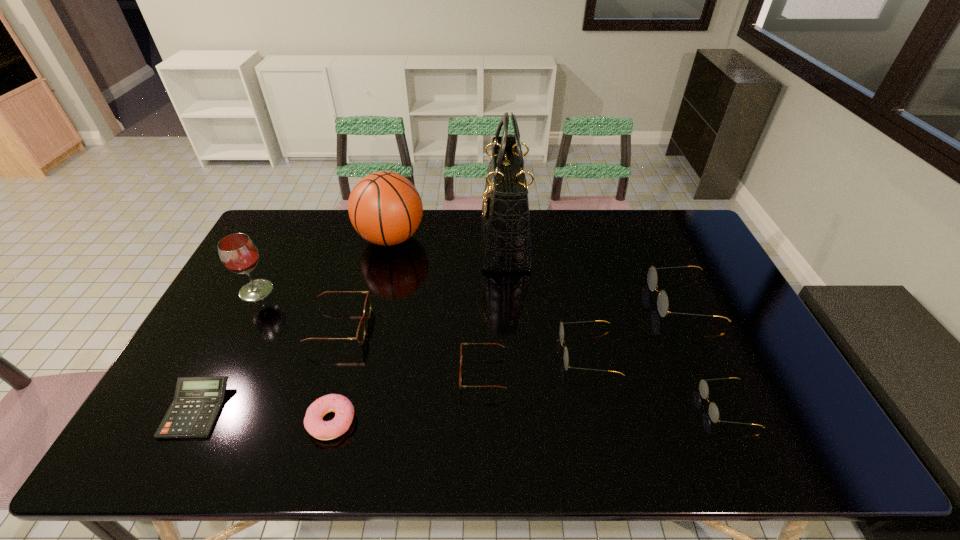
I want to click on object that is the fifth closest to the calculator, so click(x=461, y=365).

Select which spectacles is the fourth closest to the tallest object. Please provide its 2D coordinates. Your answer should be formatted as a tuple, i.e. [(x, y)], where the tuple contains the x and y coordinates of a point satisfying the conditions above.

[(360, 336)]

At what (x,y) coordinates should I click in order to perform the action: click on spectacles identified as the fourth closest to the smallest gold spectacles. Please return your answer as a coordinate pair (x, y). This screenshot has width=960, height=540. Looking at the image, I should click on (360, 336).

Identify which gold spectacles is the closest to the leftmost spectacles. Please provide its 2D coordinates. Your answer should be formatted as a tuple, i.e. [(x, y)], where the tuple contains the x and y coordinates of a point satisfying the conditions above.

[(561, 331)]

The image size is (960, 540). I want to click on gold spectacles that is the closest one to the tallest object, so click(x=561, y=331).

Locate an element on the screen. free space that satisfies the following two spatial constraints: 1. on the back side of the pink doughnut; 2. at the front view of the leftmost spectacles is located at coordinates (357, 327).

Identify the location of vacant region that satisfies the following two spatial constraints: 1. on the back side of the pink doughnut; 2. at the front view of the farther brown spectacles. The width and height of the screenshot is (960, 540). (357, 327).

The image size is (960, 540). What are the coordinates of `free space that satisfies the following two spatial constraints: 1. on the temples of the tallest spectacles; 2. on the front side of the calculator` in the screenshot? It's located at (732, 410).